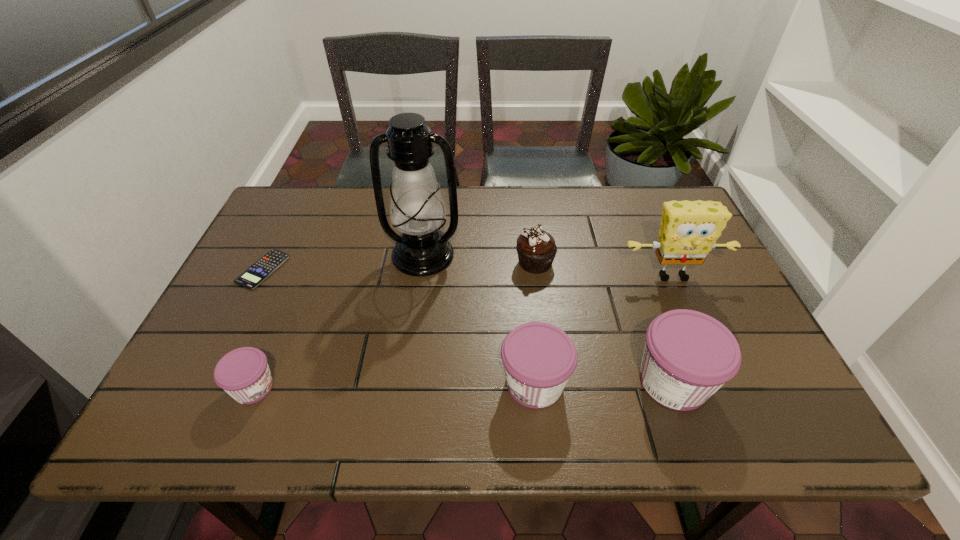
Image resolution: width=960 pixels, height=540 pixels. I want to click on jam located at the right edge, so click(688, 355).

Locate an element on the screen. The width and height of the screenshot is (960, 540). sponge that is at the right edge is located at coordinates (689, 229).

You are a GUI agent. You are given a task and a screenshot of the screen. Output one action in this format:
    pyautogui.click(x=<x>, y=<y>)
    Task: Click on the object that is at the near left corner
    
    Given the screenshot: What is the action you would take?
    pyautogui.click(x=243, y=373)

Image resolution: width=960 pixels, height=540 pixels. In order to click on object that is positioned at the near right corner in this screenshot , I will do `click(688, 355)`.

The height and width of the screenshot is (540, 960). In the image, there is a desktop. Identify the location of blank space at the far edge. (532, 195).

The height and width of the screenshot is (540, 960). What are the coordinates of `vacant position at the near edge of the desktop` in the screenshot? It's located at [x=410, y=364].

In the image, there is a desktop. Where is `vacant space at the left edge`? vacant space at the left edge is located at coordinates (263, 254).

At what (x,y) coordinates should I click in order to perform the action: click on free point at the right edge. Please return your answer as a coordinate pair (x, y). The width and height of the screenshot is (960, 540). Looking at the image, I should click on (707, 310).

In the image, there is a desktop. At what (x,y) coordinates should I click in order to perform the action: click on vacant area at the far left corner. Please return your answer as a coordinate pair (x, y). Looking at the image, I should click on (289, 188).

Find the location of a particular element. This screenshot has height=540, width=960. free region at the far right corner of the desktop is located at coordinates (661, 215).